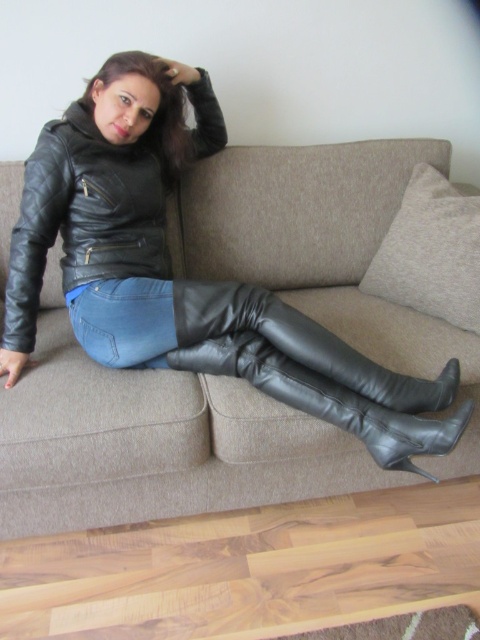
Question: Is black leather thigh-high boots at center above blue denim jeans at center?

Choices:
 (A) no
 (B) yes

Answer: (A)

Question: Estimate the real-world distances between objects in this image. Which object is farther from the beige fabric couch at center?

Choices:
 (A) blue denim jeans at center
 (B) black leather boot at lower center

Answer: (A)

Question: Is black leather thigh-high boots at center closer to the viewer compared to blue denim jeans at center?

Choices:
 (A) yes
 (B) no

Answer: (A)

Question: Does black quilted leather jacket at upper left have a smaller size compared to blue denim jeans at center?

Choices:
 (A) no
 (B) yes

Answer: (A)

Question: Which object is farther from the camera taking this photo?

Choices:
 (A) black quilted leather jacket at upper left
 (B) black leather boot at lower center
 (C) beige fabric couch at center
 (D) black leather thigh-high boots at center

Answer: (A)

Question: Which of the following is the closest to the observer?

Choices:
 (A) (254, 436)
 (B) (349, 310)
 (C) (409, 378)
 (D) (155, 323)

Answer: (A)